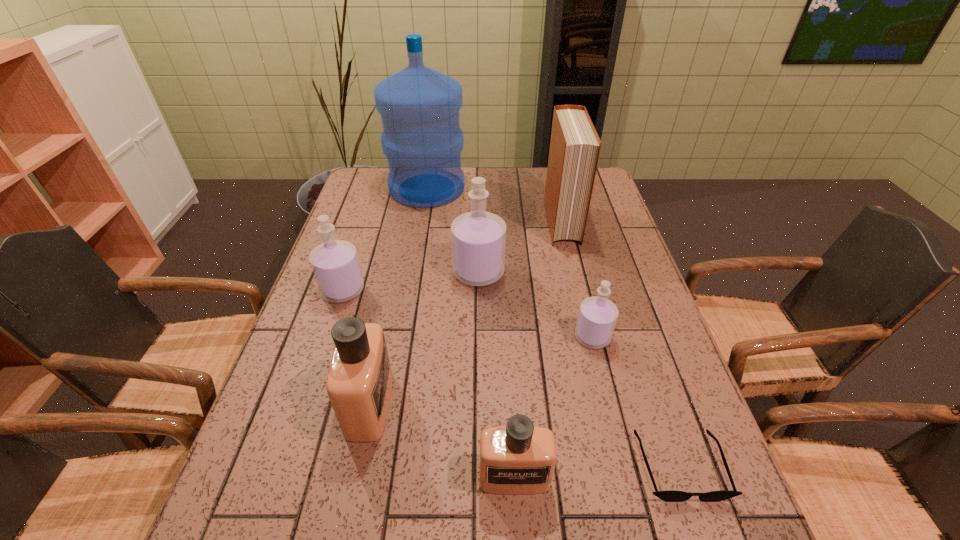
Image resolution: width=960 pixels, height=540 pixels. Identify the location of the nearest purple perfume. (597, 317).

Locate an element on the screen. Image resolution: width=960 pixels, height=540 pixels. the nearest perfume is located at coordinates (517, 459).

Find the location of `the smaller beige perfume`. the smaller beige perfume is located at coordinates (517, 459).

What are the coordinates of `black sunglasses` in the screenshot? It's located at (670, 496).

Where is `the shortest object`? The width and height of the screenshot is (960, 540). the shortest object is located at coordinates (x=670, y=496).

The width and height of the screenshot is (960, 540). I want to click on vacant space located on the right of the blue water jug, so click(512, 188).

Identify the location of free space located 0.250m on the open cover of the hardback book. This screenshot has height=540, width=960. (581, 304).

Find the location of a particular element. The height and width of the screenshot is (540, 960). vacant space located 0.140m on the front of the biggest purple perfume is located at coordinates (478, 328).

I want to click on free space located 0.260m on the right of the second smallest purple perfume, so click(x=460, y=290).

You are a GUI agent. You are given a task and a screenshot of the screen. Output one action in this format:
    pyautogui.click(x=<x>, y=<y>)
    Task: Click on the free region located on the front label of the second nearest perfume
    Image resolution: width=960 pixels, height=540 pixels.
    Given the screenshot: What is the action you would take?
    pyautogui.click(x=531, y=404)